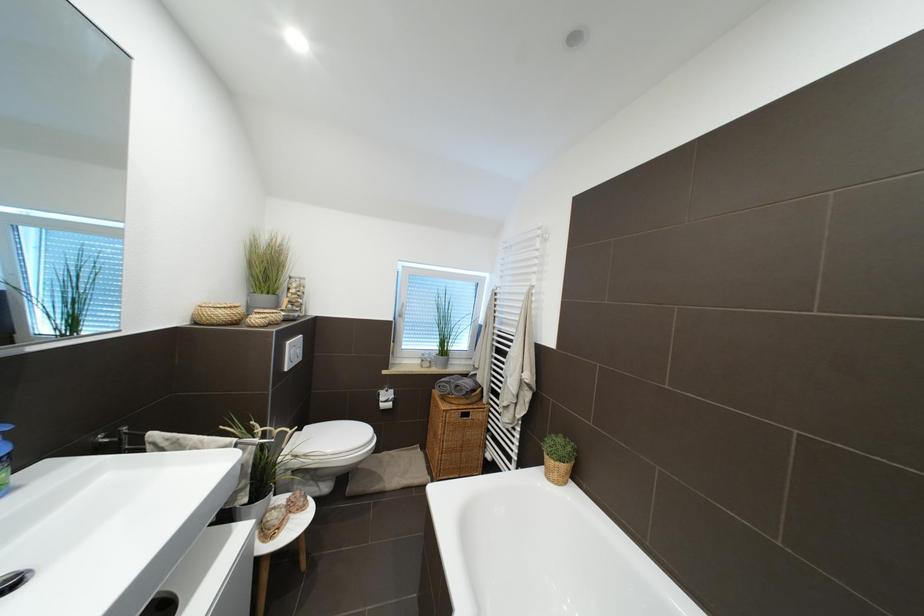
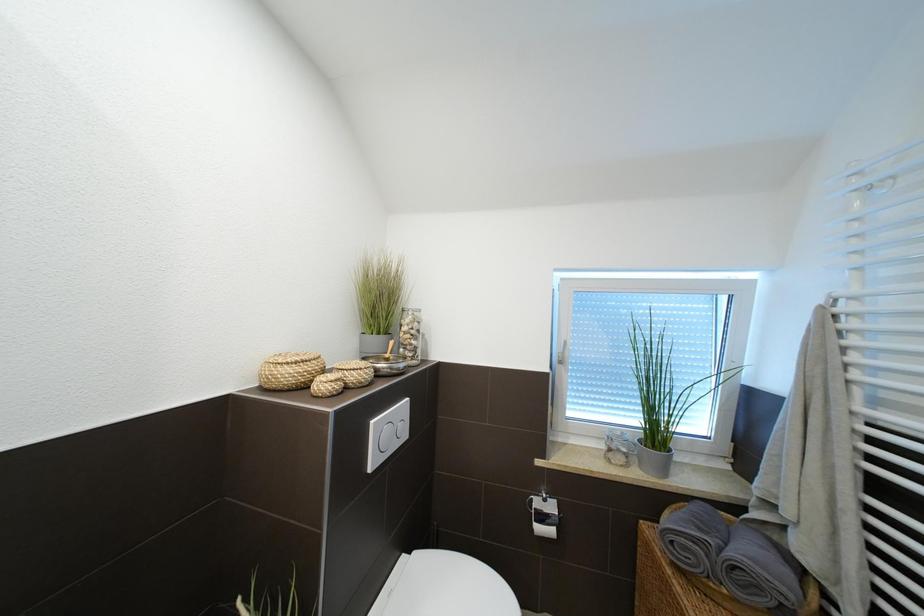
Question: The camera is either moving clockwise (left) or counter-clockwise (right) around the object. The first image is from the beginning of the video and the second image is from the end. Is the camera moving left or right when shooting the video?

Choices:
 (A) Left
 (B) Right

Answer: (B)